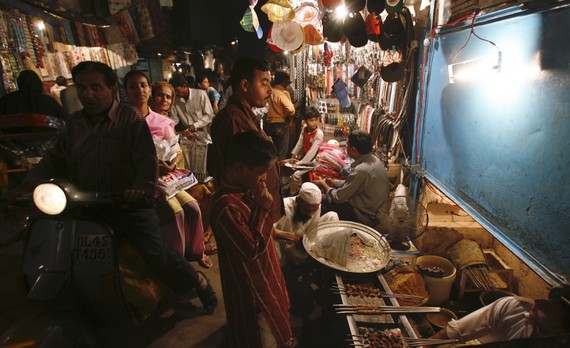
The width and height of the screenshot is (570, 348). Identify the location of light. (331, 16).